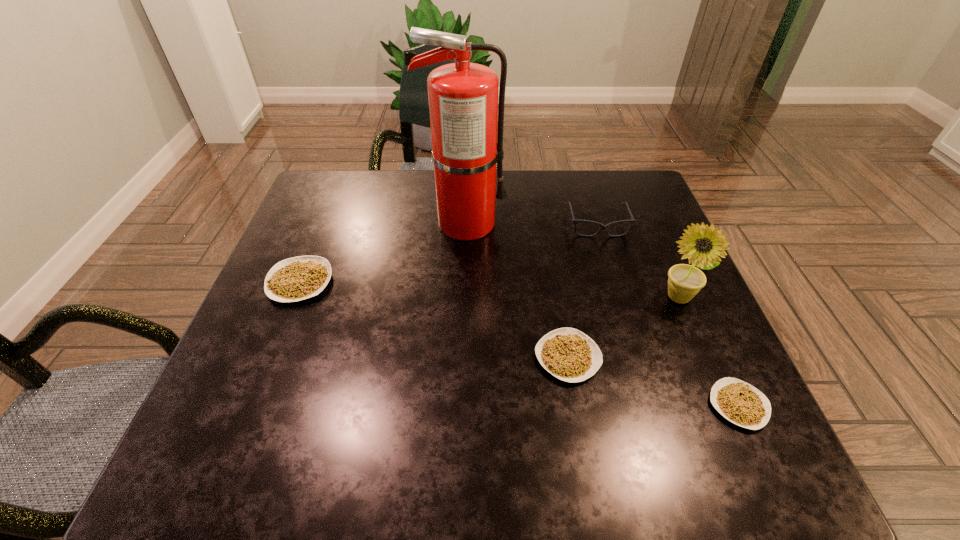
Where is `the closest object to the leftmost legume`? the closest object to the leftmost legume is located at coordinates (463, 97).

This screenshot has height=540, width=960. Find the location of `the fifth closest object to the second legume from left to right`. the fifth closest object to the second legume from left to right is located at coordinates (x=298, y=278).

In order to click on the second closest legume to the second shortest object in this screenshot , I will do `click(298, 278)`.

Select which legume appears as the third closest to the second tallest object. Please provide its 2D coordinates. Your answer should be formatted as a tuple, i.e. [(x, y)], where the tuple contains the x and y coordinates of a point satisfying the conditions above.

[(298, 278)]

Where is `free spot that satisfies the following two spatial constraints: 1. on the face of the second tallest object; 2. on the left side of the shortest legume`? Image resolution: width=960 pixels, height=540 pixels. free spot that satisfies the following two spatial constraints: 1. on the face of the second tallest object; 2. on the left side of the shortest legume is located at coordinates (724, 406).

Where is `vacant space that satisfies the following two spatial constraints: 1. at the nozzle of the fire extinguisher; 2. on the back side of the shortest legume`? This screenshot has width=960, height=540. vacant space that satisfies the following two spatial constraints: 1. at the nozzle of the fire extinguisher; 2. on the back side of the shortest legume is located at coordinates (458, 406).

Locate an element on the screen. free point that satisfies the following two spatial constraints: 1. on the front side of the shortest legume; 2. on the left side of the leftmost object is located at coordinates (251, 406).